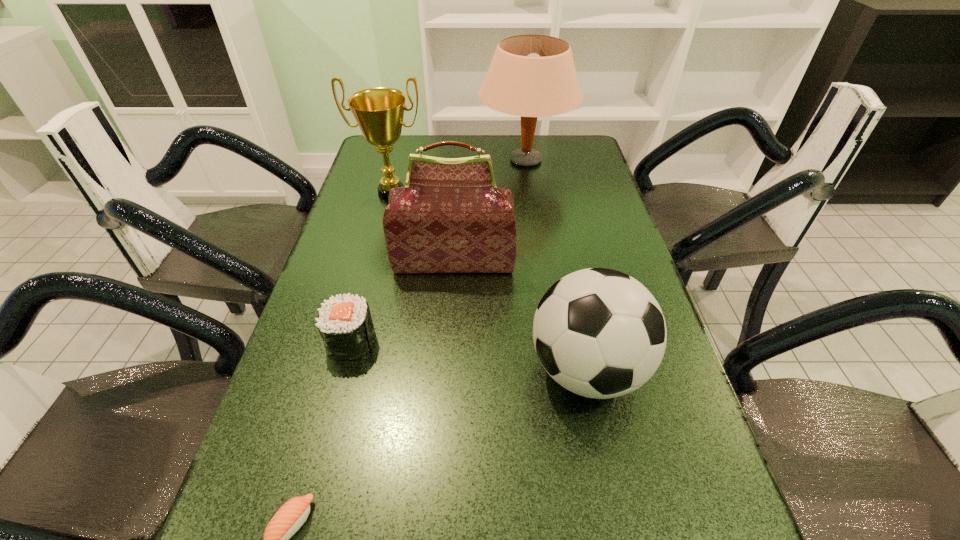
Where is `lampshade`? lampshade is located at coordinates (531, 76).

Identify the location of award. (379, 112).

At what (x,y) coordinates should I click in order to perform the action: click on handbag. Please return your answer as a coordinate pair (x, y). This screenshot has width=960, height=540. Looking at the image, I should click on (450, 217).

The height and width of the screenshot is (540, 960). Find the location of `the fourth tallest object`. the fourth tallest object is located at coordinates (599, 333).

Where is `the second shortest object`? The width and height of the screenshot is (960, 540). the second shortest object is located at coordinates pyautogui.click(x=344, y=322).

Locate an element on the screen. The image size is (960, 540). the farther sushi is located at coordinates (344, 322).

Where is `free space located 0.250m on the front-facing side of the lampshade`? Image resolution: width=960 pixels, height=540 pixels. free space located 0.250m on the front-facing side of the lampshade is located at coordinates (406, 160).

Identify the location of free space located on the front-facing side of the lampshade. (458, 160).

At what (x,y) coordinates should I click in order to perform the action: click on vacant space situated 0.170m on the front-facing side of the lampshade. Please return your answer as a coordinate pair (x, y). This screenshot has height=540, width=960. Looking at the image, I should click on (429, 160).

Identify the location of vacant area located 0.100m on the front view with handles of the award. This screenshot has width=960, height=540. (383, 228).